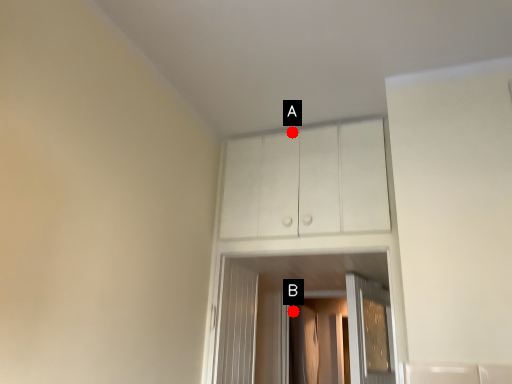
Question: Two points are circled on the image, labeled by A and B beside each circle. Among these points, which one is nearest to the camera?

Choices:
 (A) A is closer
 (B) B is closer

Answer: (A)